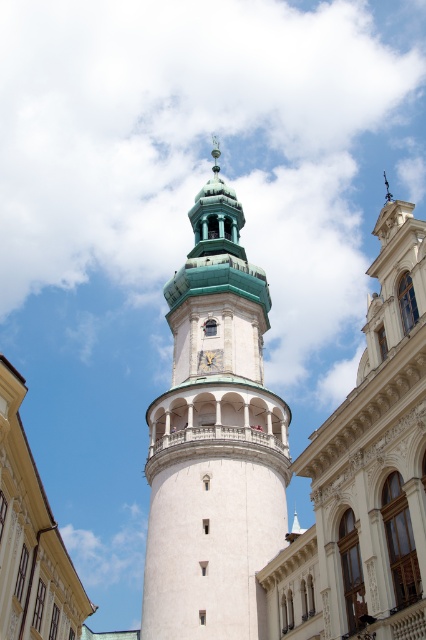
Based on the photo, which is more to the right, white stone tower at center or white stone church at center?

Positioned to the right is white stone church at center.

Can you confirm if white stone tower at center is taller than white stone church at center?

No, white stone tower at center is not taller than white stone church at center.

Who is more distant from viewer, (229, 266) or (363, 595)?

Point (229, 266)

The image size is (426, 640). Identify the location of white stone tower at center. (213, 440).

Who is taller, white stone tower at center or gold textured clock at center?

With more height is white stone tower at center.

Which is below, white stone tower at center or gold textured clock at center?

gold textured clock at center is below.

This screenshot has width=426, height=640. I want to click on white stone tower at center, so click(x=213, y=440).

I want to click on white stone tower at center, so click(213, 440).

Between white stone church at center and gold textured clock at center, which one has more height?

Standing taller between the two is white stone church at center.

Is white stone church at center to the right of gold textured clock at center from the viewer's perspective?

Indeed, white stone church at center is positioned on the right side of gold textured clock at center.

Image resolution: width=426 pixels, height=640 pixels. In order to click on white stone church at center in this screenshot , I will do `click(365, 474)`.

Identify the location of white stone church at center. This screenshot has width=426, height=640. (365, 474).